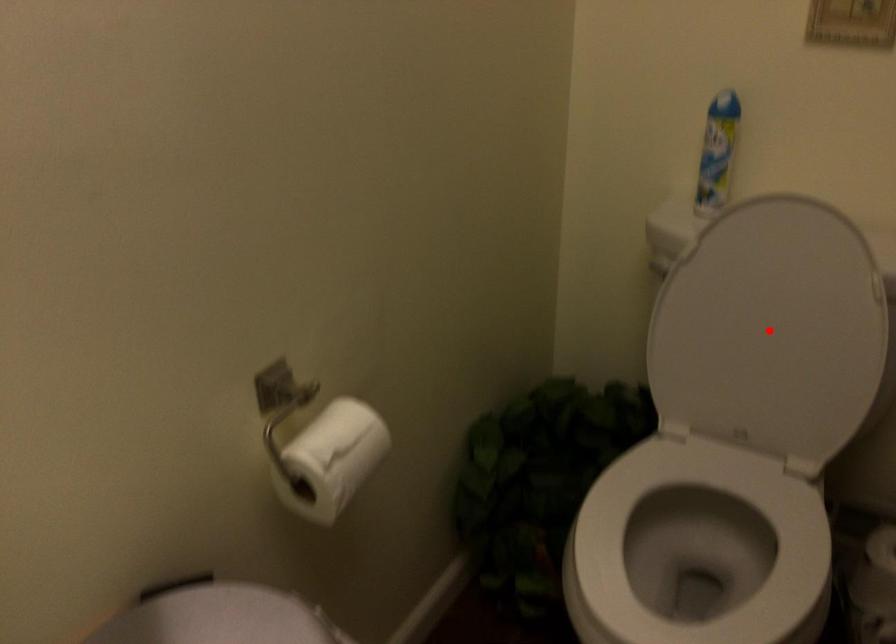
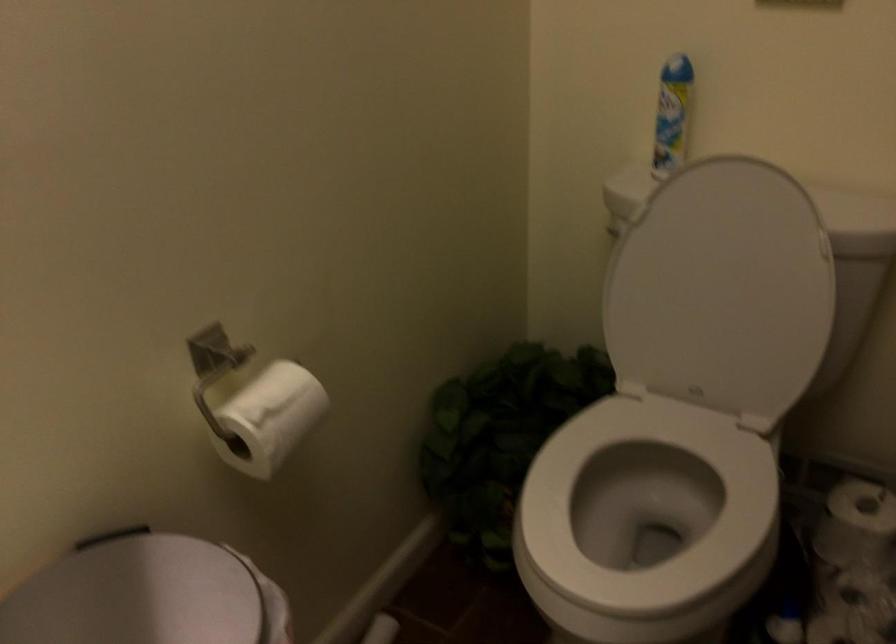
The point at the highlighted location is marked in the first image. Where is the corresponding point in the second image?

(721, 289)